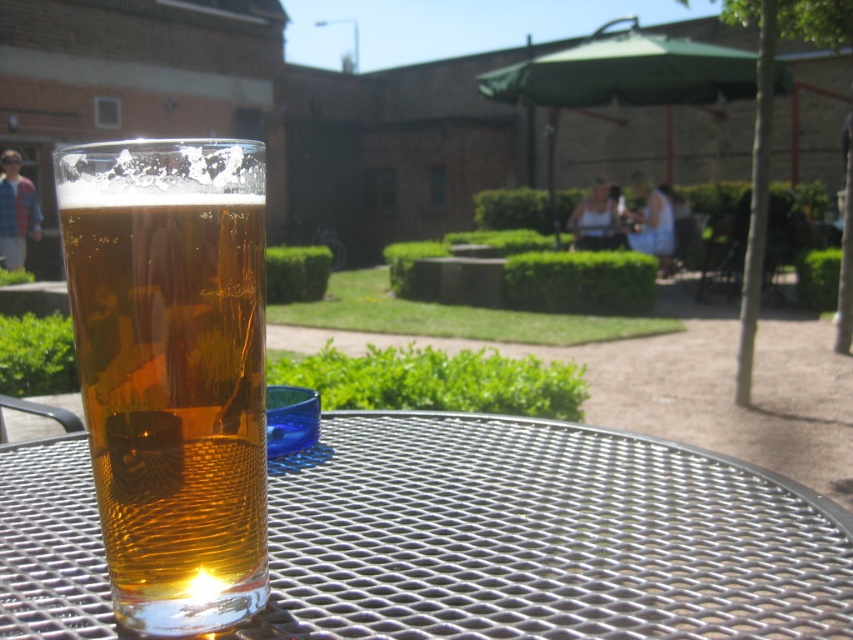
Does metallic silver table at center have a lesser width compared to translucent amber glass at center?

No.

Between metallic silver table at center and translucent amber glass at center, which one is positioned lower?

metallic silver table at center

What do you see at coordinates (541, 536) in the screenshot?
I see `metallic silver table at center` at bounding box center [541, 536].

At what (x,y) coordinates should I click in order to perform the action: click on metallic silver table at center. Please return your answer as a coordinate pair (x, y). The height and width of the screenshot is (640, 853). Looking at the image, I should click on (541, 536).